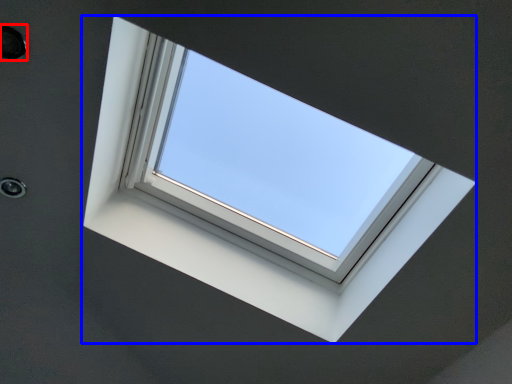
Question: Among these objects, which one is farthest to the camera, hole (highlighted by a red box) or window (highlighted by a blue box)?

Choices:
 (A) hole
 (B) window

Answer: (A)